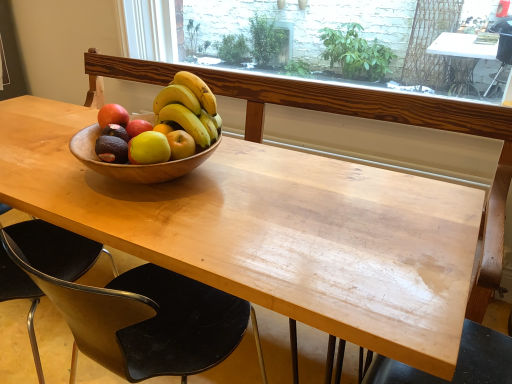
The height and width of the screenshot is (384, 512). Describe the element at coordinates (457, 362) in the screenshot. I see `black plastic chair at lower right, which is the 1th chair from right to left` at that location.

What do you see at coordinates (138, 127) in the screenshot? I see `yellow matte apple at center` at bounding box center [138, 127].

Locate an element on the screen. yellow matte bananas at center is located at coordinates (189, 108).

Describe the element at coordinates (111, 149) in the screenshot. I see `matte brown avocado at center` at that location.

This screenshot has height=384, width=512. In order to click on wooden table at center in this screenshot , I will do [x=271, y=231].

At what (x,y) coordinates should I click in order to perform the action: click on black plastic chair at lower right, the third chair positioned from the left. Please return your answer as a coordinate pair (x, y). The image size is (512, 384). Looking at the image, I should click on (457, 362).

How different are the orientations of yellow matte apple at center and yellow matte bananas at center in degrees?

0.00145 degrees.

Which is in front, point (145, 123) or point (209, 123)?

Positioned in front is point (209, 123).

Who is smaller, yellow matte apple at center or yellow matte bananas at center?

yellow matte apple at center.

Could you measure the distance between yellow matte apple at center and black plastic chair at lower right, the third chair positioned from the left?

yellow matte apple at center is 83.37 centimeters from black plastic chair at lower right, the third chair positioned from the left.

Is point (145, 125) more distant than point (460, 362)?

Yes, point (145, 125) is farther from viewer.

Would you say black plastic chair at lower right, which is the 1th chair from right to left, is part of yellow matte apple at center's contents?

Actually, black plastic chair at lower right, which is the 1th chair from right to left, is outside yellow matte apple at center.

Does yellow matte apple at center turn towards black plastic chair at lower right, the third chair positioned from the left?

No, yellow matte apple at center does not turn towards black plastic chair at lower right, the third chair positioned from the left.

Considering the points (134, 293) and (159, 135), which point is in front, point (134, 293) or point (159, 135)?

The point (134, 293) is closer to the camera.

Can you confirm if black plastic chair at lower left, the 2th chair viewed from the right, is smaller than green matte grapefruit at center?

Result: Actually, black plastic chair at lower left, the 2th chair viewed from the right, might be larger than green matte grapefruit at center.

Can you confirm if black plastic chair at lower left, placed as the second chair when sorted from left to right, is positioned to the left of green matte grapefruit at center?

No.

Considering their positions, is black plastic chair at lower left, placed as the second chair when sorted from left to right, located in front of or behind green matte grapefruit at center?

In the image, black plastic chair at lower left, placed as the second chair when sorted from left to right, appears in front of green matte grapefruit at center.

Looking at this image, is black plastic chair at lower left, the 1th chair positioned from the left, touching black plastic chair at lower right, the third chair positioned from the left?

black plastic chair at lower left, the 1th chair positioned from the left, and black plastic chair at lower right, the third chair positioned from the left, are clearly separated.

Which chair is the 2nd one when counting from the back of the black plastic chair at lower right, the third chair positioned from the left? Please provide its 2D coordinates.

[(57, 249)]

Does point (5, 299) appear closer or farther from the camera than point (412, 376)?

Point (5, 299) appears to be farther away from the viewer than point (412, 376).

How many degrees apart are the facing directions of black plastic chair at lower left, the 1th chair positioned from the left, and black plastic chair at lower right, which is the 1th chair from right to left?

The angle between the facing direction of black plastic chair at lower left, the 1th chair positioned from the left, and the facing direction of black plastic chair at lower right, which is the 1th chair from right to left, is 90 degrees.

From the image's perspective, which one is positioned lower, black plastic chair at lower left, placed as the second chair when sorted from left to right, or wooden table at center?

black plastic chair at lower left, placed as the second chair when sorted from left to right, is shown below in the image.

Does black plastic chair at lower left, placed as the second chair when sorted from left to right, contain wooden table at center?

No, wooden table at center is not inside black plastic chair at lower left, placed as the second chair when sorted from left to right.

Consider the image. From a real-world perspective, is black plastic chair at lower left, placed as the second chair when sorted from left to right, on wooden table at center?

Incorrect, from a real-world perspective, black plastic chair at lower left, placed as the second chair when sorted from left to right, is lower than wooden table at center.

Is matte brown avocado at center thinner than green matte grapefruit at center?

Indeed, matte brown avocado at center has a lesser width compared to green matte grapefruit at center.

Consider the image. From a real-world perspective, is matte brown avocado at center on top of green matte grapefruit at center?

No, from a real-world perspective, matte brown avocado at center is not above green matte grapefruit at center.

This screenshot has width=512, height=384. In the image, there is a green matte grapefruit at center. Identify the location of avocado above it (from the image's perspective). pyautogui.click(x=111, y=149).

Does matte brown avocado at center touch green matte grapefruit at center?

Yes, the surface of matte brown avocado at center is in contact with green matte grapefruit at center.

Is green matte grapefruit at center a part of black plastic chair at lower right, the third chair positioned from the left?

No.

Is the depth of black plastic chair at lower right, which is the 1th chair from right to left, greater than that of green matte grapefruit at center?

No, black plastic chair at lower right, which is the 1th chair from right to left, is closer to the viewer.

Are black plastic chair at lower right, which is the 1th chair from right to left, and green matte grapefruit at center making contact?

black plastic chair at lower right, which is the 1th chair from right to left, is not next to green matte grapefruit at center, and they're not touching.

Considering the points (384, 377) and (161, 160), which point is in front, point (384, 377) or point (161, 160)?

The point (161, 160) is in front.

In the image, there is a yellow matte bananas at center. Where is `apple below it (from the image's perspective)`? The width and height of the screenshot is (512, 384). apple below it (from the image's perspective) is located at coordinates (138, 127).

The image size is (512, 384). Identify the location of apple that appears behind the black plastic chair at lower right, which is the 1th chair from right to left. (138, 127).

Which object lies further to the anchor point wooden table at center, black plastic chair at lower left, the 2th chair viewed from the right, or yellow matte apple at center?

yellow matte apple at center lies further to wooden table at center than the other object.

Estimate the real-world distances between objects in this image. Which object is closer to yellow matte bananas at center, black plastic chair at lower right, the third chair positioned from the left, or matte brown avocado at center?

The object closer to yellow matte bananas at center is matte brown avocado at center.

Estimate the real-world distances between objects in this image. Which object is further from wooden table at center, yellow matte bananas at center or black plastic chair at lower left, the 1th chair positioned from the left?

black plastic chair at lower left, the 1th chair positioned from the left, lies further to wooden table at center than the other object.

When comparing their distances from black plastic chair at lower left, placed as the third chair when sorted from right to left, does matte brown avocado at center or wooden table at center seem further?

matte brown avocado at center is positioned further to the anchor black plastic chair at lower left, placed as the third chair when sorted from right to left.

Looking at the image, which one is located further to wooden table at center, black plastic chair at lower right, which is the 1th chair from right to left, or yellow matte apple at center?

black plastic chair at lower right, which is the 1th chair from right to left, is further to wooden table at center.

Based on their spatial positions, is yellow matte bananas at center or black plastic chair at lower left, placed as the third chair when sorted from right to left, further from yellow matte apple at center?

The object further to yellow matte apple at center is black plastic chair at lower left, placed as the third chair when sorted from right to left.

Which object lies nearer to the anchor point yellow matte apple at center, black plastic chair at lower left, placed as the third chair when sorted from right to left, or green matte grapefruit at center?

Based on the image, green matte grapefruit at center appears to be nearer to yellow matte apple at center.

Which object lies further to the anchor point black plastic chair at lower right, which is the 1th chair from right to left, yellow matte apple at center or wooden table at center?

Among the two, yellow matte apple at center is located further to black plastic chair at lower right, which is the 1th chair from right to left.

This screenshot has height=384, width=512. What are the coordinates of `banana between green matte grapefruit at center and yellow matte apple at center along the z-axis` in the screenshot? It's located at (189, 108).

Identify the location of grapefruit between wooden table at center and yellow matte apple at center along the z-axis. Image resolution: width=512 pixels, height=384 pixels. (149, 148).

Find the location of `chair between yellow matte apple at center and black plastic chair at lower right, the third chair positioned from the left`. chair between yellow matte apple at center and black plastic chair at lower right, the third chair positioned from the left is located at coordinates (133, 310).

Identify the location of avocado between wooden table at center and black plastic chair at lower right, which is the 1th chair from right to left, from left to right. (111, 149).